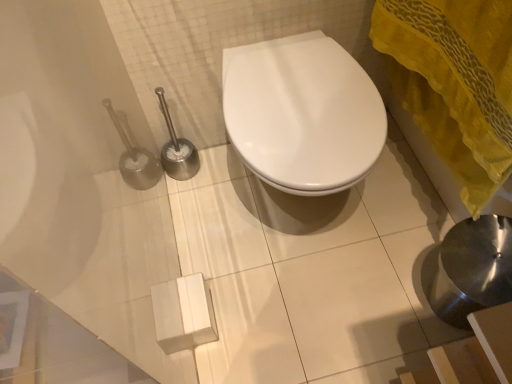
The height and width of the screenshot is (384, 512). Describe the element at coordinates (302, 113) in the screenshot. I see `white glossy toilet at center` at that location.

What is the approximate width of white glossy toilet at center?

white glossy toilet at center is 21.11 inches wide.

Find the location of `white glossy toilet at center`. white glossy toilet at center is located at coordinates (302, 113).

In order to face yellow sheer fabric at right, should I rotate leftwards or rightwards?

It's best to rotate right around 22.812 degrees.

This screenshot has width=512, height=384. Find the location of `yellow sheer fabric at right`. yellow sheer fabric at right is located at coordinates (455, 83).

This screenshot has width=512, height=384. Describe the element at coordinates (455, 83) in the screenshot. I see `yellow sheer fabric at right` at that location.

Image resolution: width=512 pixels, height=384 pixels. What are the coordinates of `white glossy toilet at center` in the screenshot? It's located at (302, 113).

Which object is positioned more to the right, yellow sheer fabric at right or white glossy toilet at center?

From the viewer's perspective, yellow sheer fabric at right appears more on the right side.

Between yellow sheer fabric at right and white glossy toilet at center, which one is positioned in front?

Positioned in front is yellow sheer fabric at right.

Is point (411, 45) less distant than point (271, 184)?

No.

From the image's perspective, which one is positioned higher, yellow sheer fabric at right or white glossy toilet at center?

yellow sheer fabric at right appears higher in the image.

From a real-world perspective, between yellow sheer fabric at right and white glossy toilet at center, who is vertically higher?

yellow sheer fabric at right is physically above.

Looking at their sizes, would you say yellow sheer fabric at right is wider or thinner than white glossy toilet at center?

In the image, yellow sheer fabric at right appears to be more narrow than white glossy toilet at center.

From their relative heights in the image, would you say yellow sheer fabric at right is taller or shorter than white glossy toilet at center?

In the image, yellow sheer fabric at right appears to be taller than white glossy toilet at center.

Considering the relative sizes of yellow sheer fabric at right and white glossy toilet at center in the image provided, is yellow sheer fabric at right bigger than white glossy toilet at center?

No, yellow sheer fabric at right is not bigger than white glossy toilet at center.

Can we say yellow sheer fabric at right lies outside white glossy toilet at center?

Indeed, yellow sheer fabric at right is completely outside white glossy toilet at center.

Is yellow sheer fabric at right positioned far away from white glossy toilet at center?

yellow sheer fabric at right is near white glossy toilet at center, not far away.

Could you tell me if yellow sheer fabric at right is facing white glossy toilet at center?

Yes, yellow sheer fabric at right is aimed at white glossy toilet at center.

What's the angular difference between yellow sheer fabric at right and white glossy toilet at center's facing directions?

They differ by 87.1 degrees in their facing directions.

Measure the distance from yellow sheer fabric at right to white glossy toilet at center.

yellow sheer fabric at right and white glossy toilet at center are 22.68 centimeters apart from each other.

Image resolution: width=512 pixels, height=384 pixels. Find the location of `bath towel on the right of the white glossy toilet at center`. bath towel on the right of the white glossy toilet at center is located at coordinates (455, 83).

From the picture: Is white glossy toilet at center at the left side of yellow sheer fabric at right?

Correct, you'll find white glossy toilet at center to the left of yellow sheer fabric at right.

Which object is further away from the camera, white glossy toilet at center or yellow sheer fabric at right?

Positioned behind is white glossy toilet at center.

Does point (366, 108) come in front of point (433, 94)?

Yes, point (366, 108) is closer to viewer.

From the image's perspective, which object appears higher, white glossy toilet at center or yellow sheer fabric at right?

yellow sheer fabric at right.

From a real-world perspective, who is located lower, white glossy toilet at center or yellow sheer fabric at right?

white glossy toilet at center.

Which of these two, white glossy toilet at center or yellow sheer fabric at right, is wider?

white glossy toilet at center is wider.

Does white glossy toilet at center have a greater height compared to yellow sheer fabric at right?

Incorrect, the height of white glossy toilet at center is not larger of that of yellow sheer fabric at right.

Which of these two, white glossy toilet at center or yellow sheer fabric at right, is smaller?

yellow sheer fabric at right is smaller.

Is white glossy toilet at center surrounding yellow sheer fabric at right?

Actually, yellow sheer fabric at right is outside white glossy toilet at center.

Is white glossy toilet at center placed right next to yellow sheer fabric at right?

They are not placed beside each other.

Does white glossy toilet at center turn towards yellow sheer fabric at right?

No, white glossy toilet at center is not facing towards yellow sheer fabric at right.

Measure the distance between white glossy toilet at center and yellow sheer fabric at right.

white glossy toilet at center is 8.93 inches from yellow sheer fabric at right.

Find the location of a particular element. toilet on the left of yellow sheer fabric at right is located at coordinates (302, 113).

At what (x,y) coordinates should I click in order to perform the action: click on toilet below the yellow sheer fabric at right (from the image's perspective). Please return your answer as a coordinate pair (x, y). Image resolution: width=512 pixels, height=384 pixels. Looking at the image, I should click on (302, 113).

Find the location of `toilet behind the yellow sheer fabric at right`. toilet behind the yellow sheer fabric at right is located at coordinates (302, 113).